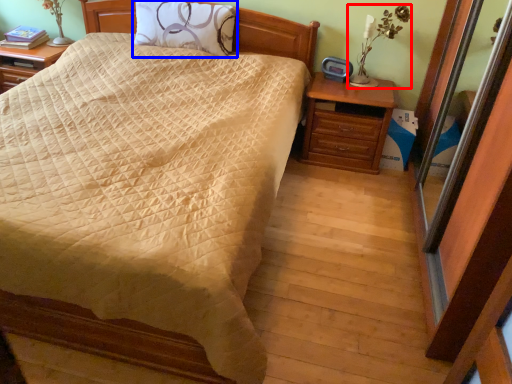
Question: Among these objects, which one is nearest to the camera, table lamp (highlighted by a red box) or pillow (highlighted by a blue box)?

Choices:
 (A) table lamp
 (B) pillow

Answer: (A)